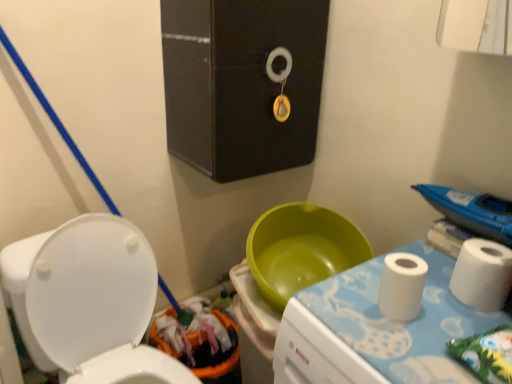
Question: Is black matte medicine cabinet at upper center not within white matte toilet paper at right?

Choices:
 (A) yes
 (B) no

Answer: (A)

Question: Is black matte medicine cabinet at upper center at the left side of white matte toilet paper at right?

Choices:
 (A) no
 (B) yes

Answer: (B)

Question: From the image's perspective, is black matte medicine cabinet at upper center below white matte toilet paper at right?

Choices:
 (A) no
 (B) yes

Answer: (A)

Question: From a real-world perspective, is black matte medicine cabinet at upper center located beneath white matte toilet paper at right?

Choices:
 (A) yes
 (B) no

Answer: (B)

Question: From the image's perspective, is black matte medicine cabinet at upper center above white matte toilet paper at right?

Choices:
 (A) no
 (B) yes

Answer: (B)

Question: Based on their sizes in the image, would you say orange fabric potty at lower left is bigger or smaller than white matte toilet paper at right?

Choices:
 (A) big
 (B) small

Answer: (A)

Question: From the image's perspective, is orange fabric potty at lower left positioned above or below white matte toilet paper at right?

Choices:
 (A) above
 (B) below

Answer: (B)

Question: Is orange fabric potty at lower left in front of or behind white matte toilet paper at right in the image?

Choices:
 (A) front
 (B) behind

Answer: (B)

Question: From a real-world perspective, relative to white matte toilet paper at right, is orange fabric potty at lower left vertically above or below?

Choices:
 (A) above
 (B) below

Answer: (B)

Question: Looking at their shapes, would you say white glossy toilet at lower left is wider or thinner than white matte toilet paper at right?

Choices:
 (A) wide
 (B) thin

Answer: (A)

Question: From the image's perspective, is white glossy toilet at lower left above or below white matte toilet paper at right?

Choices:
 (A) below
 (B) above

Answer: (A)

Question: Looking at the image, does white glossy toilet at lower left seem bigger or smaller compared to white matte toilet paper at right?

Choices:
 (A) big
 (B) small

Answer: (A)

Question: From their relative heights in the image, would you say white glossy toilet at lower left is taller or shorter than white matte toilet paper at right?

Choices:
 (A) short
 (B) tall

Answer: (B)

Question: From a real-world perspective, is orange fabric potty at lower left above or below white paper towel at right?

Choices:
 (A) below
 (B) above

Answer: (A)

Question: From their relative heights in the image, would you say orange fabric potty at lower left is taller or shorter than white paper towel at right?

Choices:
 (A) short
 (B) tall

Answer: (B)